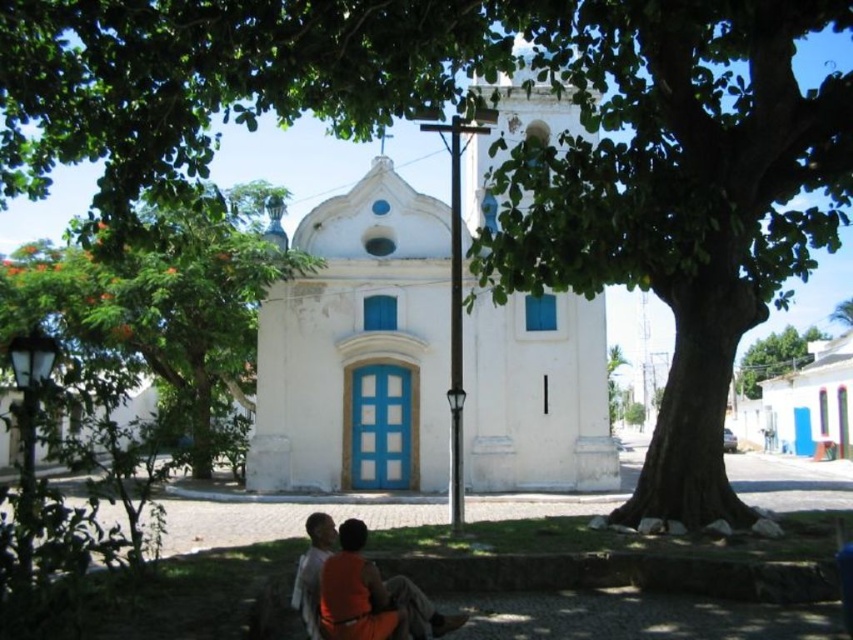
From the picture: You are standing at the origin point of the coordinate system. Looking at the image, where is the white smooth chapel at center located in terms of coordinates?

The white smooth chapel at center is located at coordinates point (358, 348).

You are standing at the edge of the paved area in front of the white smooth chapel at center. You want to take a photo of the orange fabric shirt at lower center without the chapel blocking the view. Is the chapel taller than the shirt?

The white smooth chapel at center has a greater height compared to the orange fabric shirt at lower center, so the chapel is taller and may block the view when taking a photo of the shirt.

You are standing in front of the white church with blue accents and notice two points marked on the ground. The first point is at coordinates point (578,26) and the second is at point (344,595). Which point is closer to you?

Point (578,26) is further to the camera than point (344,595), so the point closer to you is point (344,595).